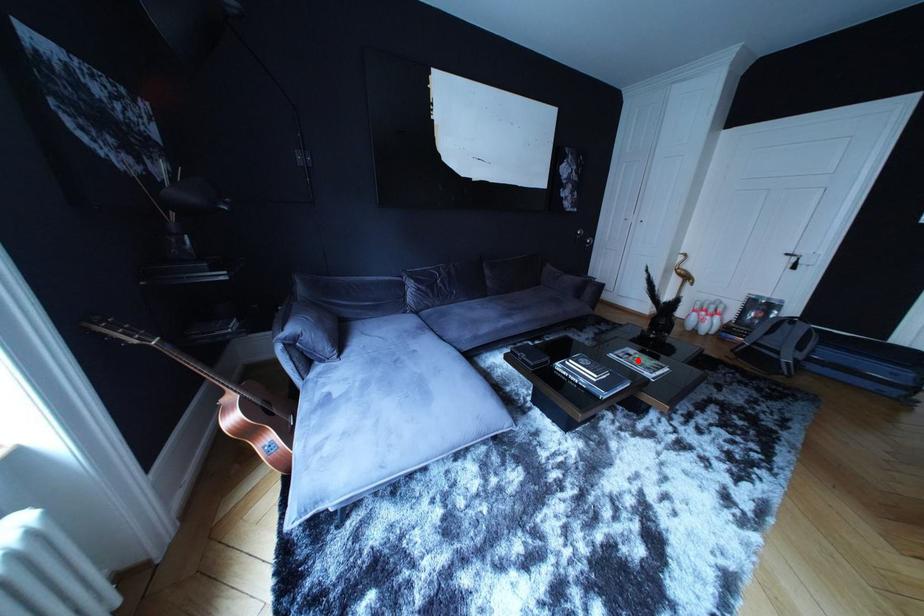
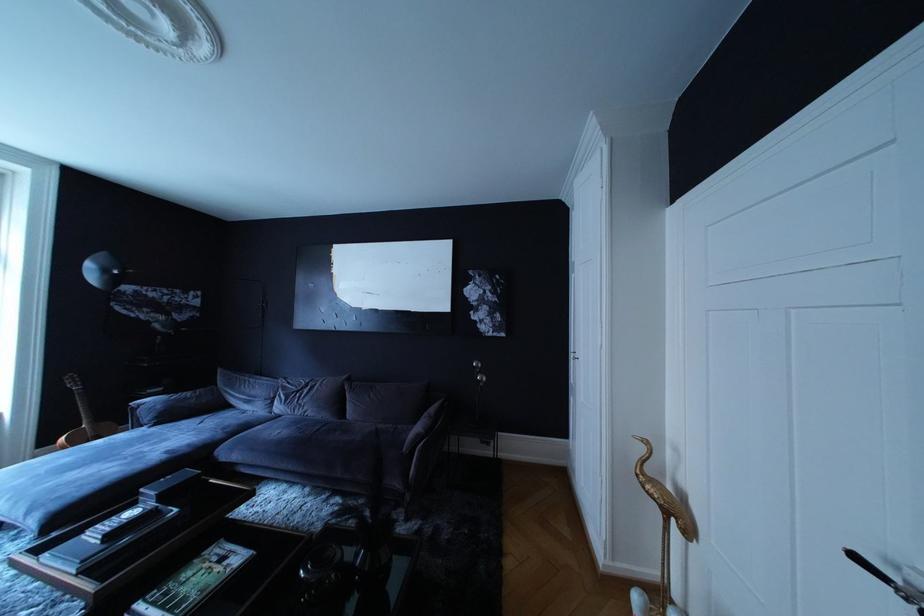
Question: I am providing you with two images of the same scene from different viewpoints. Given a red point in image1, look at the same physical point in image2. Is it:

Choices:
 (A) Closer to the viewpoint
 (B) Farther from the viewpoint

Answer: (B)